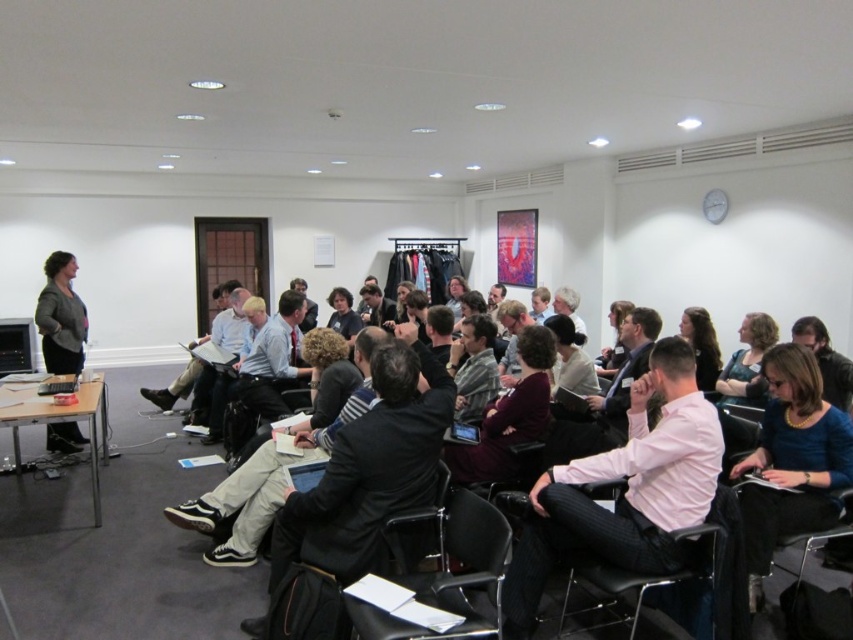
From the picture: You are a photographer standing at the camera position in the conference room. You want to take a photo of the black leather chair at lower center. Is the distance between you and the chair sufficient to capture a clear, full view of the chair without needing to move closer?

The distance between the black leather chair at lower center and the camera is 2.14 meters, which is sufficient to capture a clear, full view of the chair without needing to move closer.

You are organizing a small meeting in the conference room and need to seat two people. You have a guest who prefers a smaller chair and another who prefers a larger chair. Which black leather chair at lower center and which black leather chair at center should each guest take?

The guest who prefers a smaller chair should take the black leather chair at lower center, while the guest who prefers a larger chair should take the black leather chair at center since it is bigger.